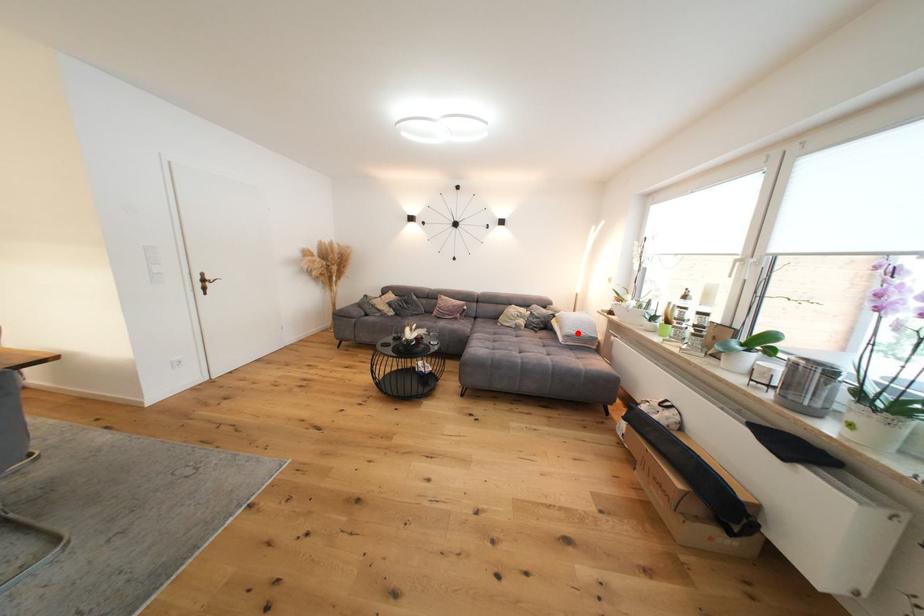
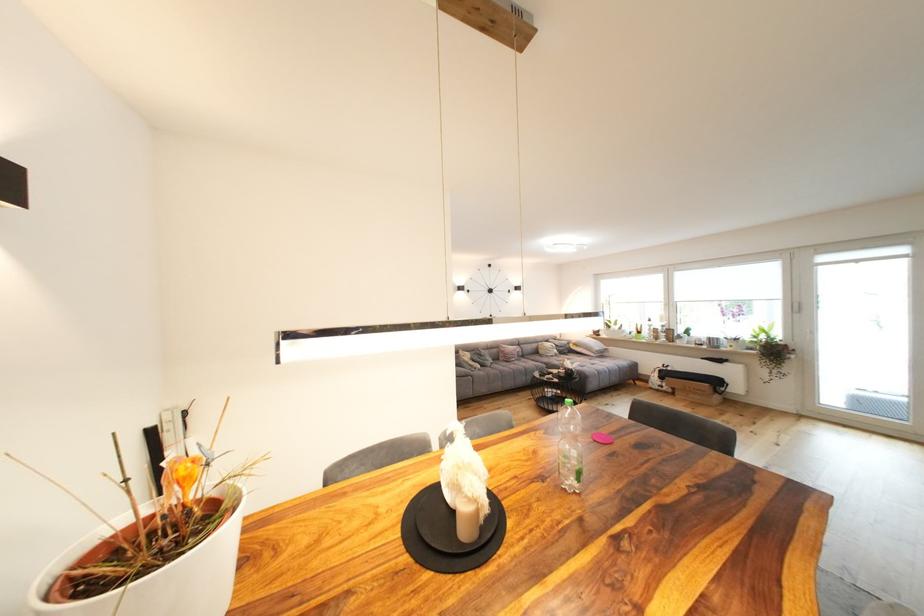
Where in the second image is the point corresponding to the highlighted location from the first image?

(603, 350)